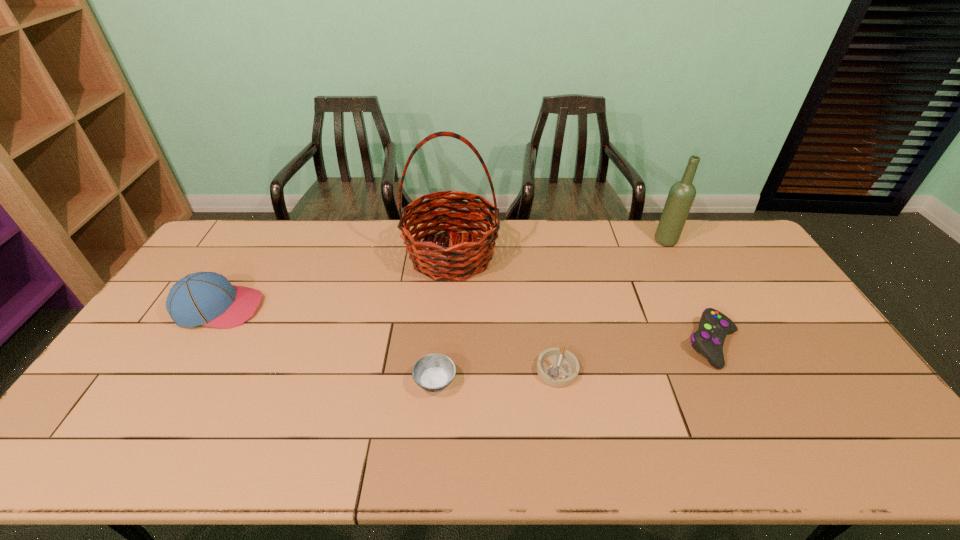
Locate an element on the screen. This screenshot has height=540, width=960. vacant space that satisfies the following two spatial constraints: 1. on the back side of the taller ashtray; 2. on the left side of the fifth shortest object is located at coordinates point(447,241).

The height and width of the screenshot is (540, 960). In order to click on free space that satisfies the following two spatial constraints: 1. on the handle side of the tallest object; 2. on the left side of the shorter ashtray in this screenshot , I will do `click(443, 370)`.